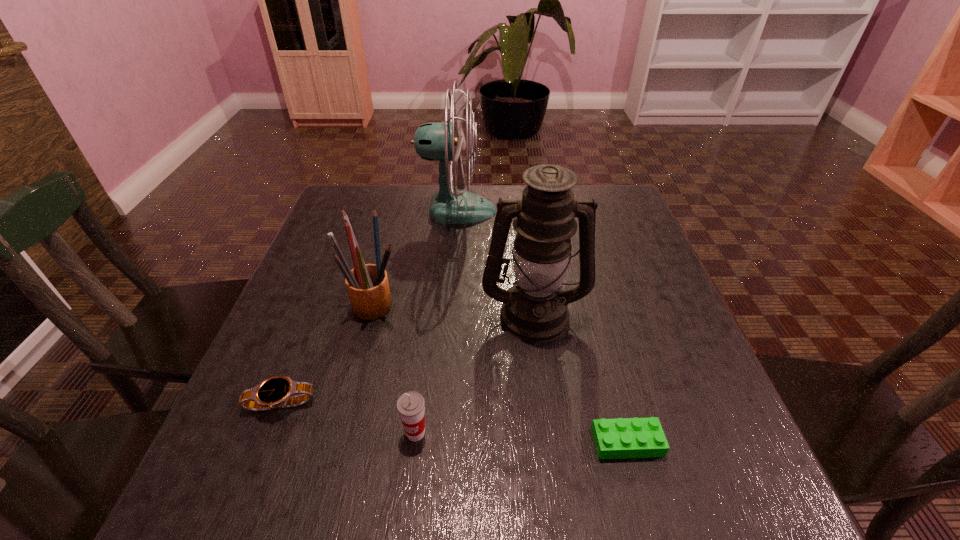
Where is `the farthest object`? the farthest object is located at coordinates (433, 141).

I want to click on oil lamp, so click(x=534, y=309).

Locate an element on the screen. pencil box is located at coordinates (367, 284).

Identify the location of the third shortest object. (411, 406).

At what (x,y) coordinates should I click in order to perform the action: click on the fourth farthest object. Please return your answer as a coordinate pair (x, y). The height and width of the screenshot is (540, 960). Looking at the image, I should click on (272, 393).

This screenshot has width=960, height=540. Identify the location of Lego. (620, 438).

Locate an element on the screen. This screenshot has width=960, height=540. vacant space situated in front of the farthest object, directing airflow is located at coordinates (521, 211).

Locate an element on the screen. Image resolution: width=960 pixels, height=540 pixels. free location located 0.380m on the back of the oil lamp is located at coordinates (519, 199).

Locate an element on the screen. The image size is (960, 540). vacant region located on the front of the fourth shortest object is located at coordinates [x=327, y=495].

Locate an element on the screen. The image size is (960, 540). vacant region located on the side of the cup with the logo is located at coordinates (406, 512).